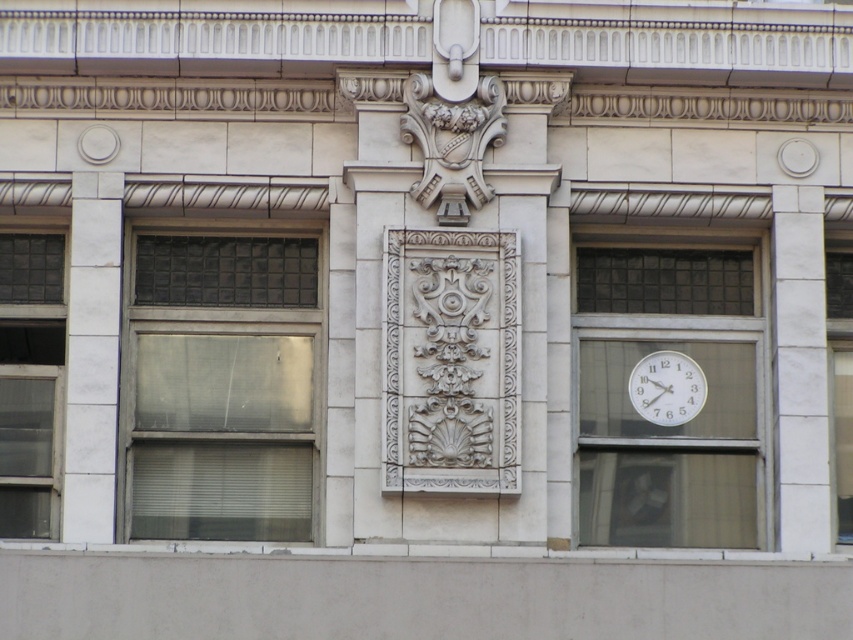
Question: Which object is farther from the camera taking this photo?

Choices:
 (A) white glossy clock at upper right
 (B) clear glass window at center

Answer: (B)

Question: Which of the following is the farthest from the observer?

Choices:
 (A) white glossy clock at upper right
 (B) white glass clock at right

Answer: (B)

Question: Can you confirm if clear glass window at left is positioned to the left of clear glass window at center?

Choices:
 (A) yes
 (B) no

Answer: (A)

Question: Does white glass clock at right have a lesser width compared to clear glass window at center?

Choices:
 (A) yes
 (B) no

Answer: (B)

Question: Estimate the real-world distances between objects in this image. Which object is farther from the clear glass window at center?

Choices:
 (A) white glossy clock at upper right
 (B) white glass clock at right
 (C) matte glass window at left
 (D) clear glass window at left

Answer: (D)

Question: Does matte glass window at left appear on the left side of white glass clock at right?

Choices:
 (A) yes
 (B) no

Answer: (A)